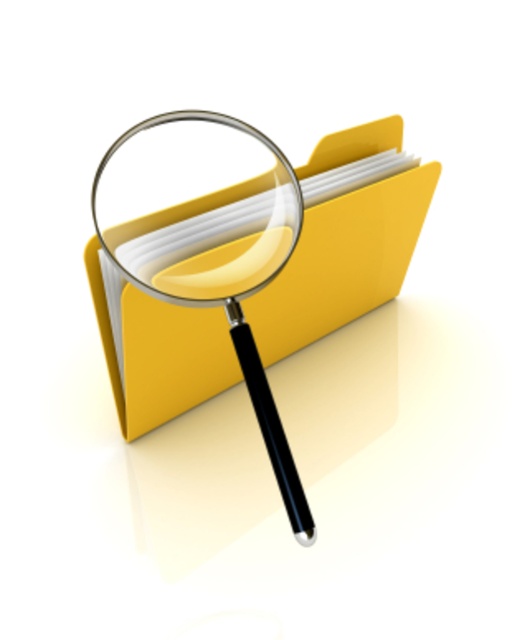
Question: Which point is farther from the camera taking this photo?

Choices:
 (A) (178, 224)
 (B) (244, 262)

Answer: (A)

Question: Which point is closer to the camera?

Choices:
 (A) (206, 282)
 (B) (184, 134)

Answer: (A)

Question: Is transparent plastic magnifying glass at center further to the viewer compared to transparent glass magnifying glass at center?

Choices:
 (A) no
 (B) yes

Answer: (A)

Question: From the image, what is the correct spatial relationship of transparent plastic magnifying glass at center in relation to transparent glass magnifying glass at center?

Choices:
 (A) right
 (B) left

Answer: (A)

Question: Observing the image, what is the correct spatial positioning of transparent plastic magnifying glass at center in reference to transparent glass magnifying glass at center?

Choices:
 (A) left
 (B) right

Answer: (B)

Question: Which point is farther to the camera?

Choices:
 (A) coord(128,134)
 (B) coord(221,163)

Answer: (B)